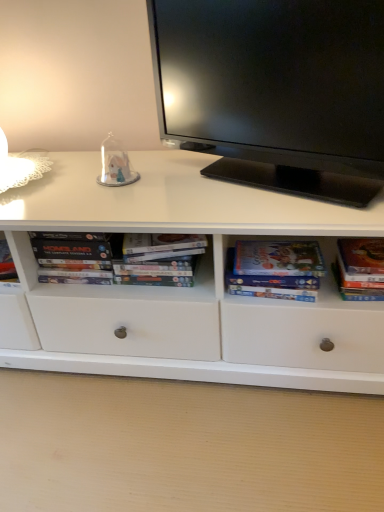
Question: Is transparent glass dome at center positioned far away from black glossy television at upper center?

Choices:
 (A) no
 (B) yes

Answer: (A)

Question: Is transparent glass dome at center positioned with its back to black glossy television at upper center?

Choices:
 (A) no
 (B) yes

Answer: (A)

Question: From the image's perspective, is transparent glass dome at center located above black glossy television at upper center?

Choices:
 (A) no
 (B) yes

Answer: (A)

Question: Could you tell me if transparent glass dome at center is turned towards black glossy television at upper center?

Choices:
 (A) no
 (B) yes

Answer: (A)

Question: From the image's perspective, is transparent glass dome at center beneath black glossy television at upper center?

Choices:
 (A) no
 (B) yes

Answer: (B)

Question: Can you confirm if transparent glass dome at center is smaller than black glossy television at upper center?

Choices:
 (A) yes
 (B) no

Answer: (A)

Question: Is black glossy television at upper center far away from transparent glass dome at center?

Choices:
 (A) no
 (B) yes

Answer: (A)

Question: From a real-world perspective, is black glossy television at upper center located beneath transparent glass dome at center?

Choices:
 (A) yes
 (B) no

Answer: (B)

Question: Considering the relative positions of black glossy television at upper center and transparent glass dome at center in the image provided, is black glossy television at upper center to the right of transparent glass dome at center from the viewer's perspective?

Choices:
 (A) no
 (B) yes

Answer: (B)

Question: Does black glossy television at upper center come behind transparent glass dome at center?

Choices:
 (A) no
 (B) yes

Answer: (A)

Question: Is black glossy television at upper center smaller than transparent glass dome at center?

Choices:
 (A) no
 (B) yes

Answer: (A)

Question: Considering the relative sizes of black glossy television at upper center and transparent glass dome at center in the image provided, is black glossy television at upper center wider than transparent glass dome at center?

Choices:
 (A) yes
 (B) no

Answer: (A)

Question: From the image's perspective, is matte paper book at center right, which is the 1th paperback book from left to right, over transparent glass dome at center?

Choices:
 (A) no
 (B) yes

Answer: (A)